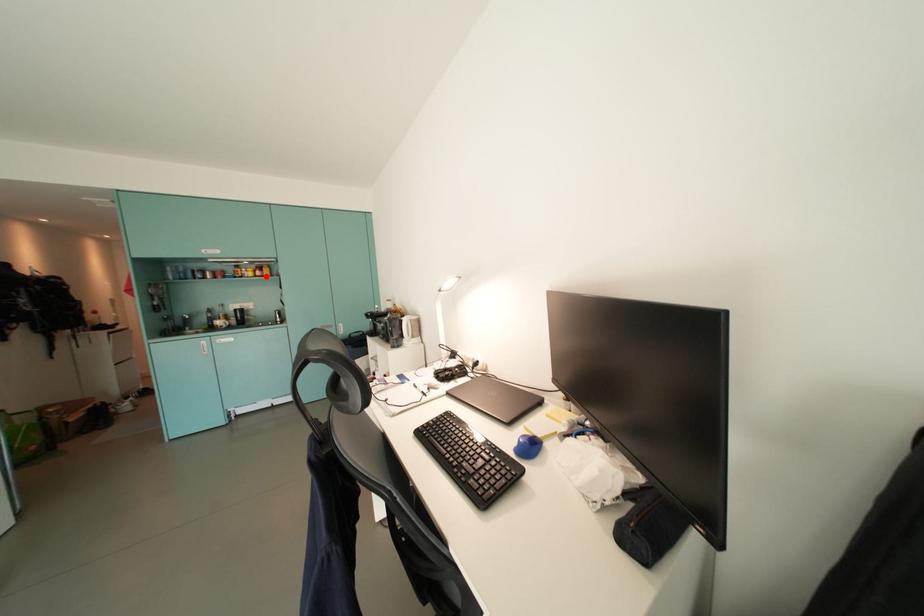
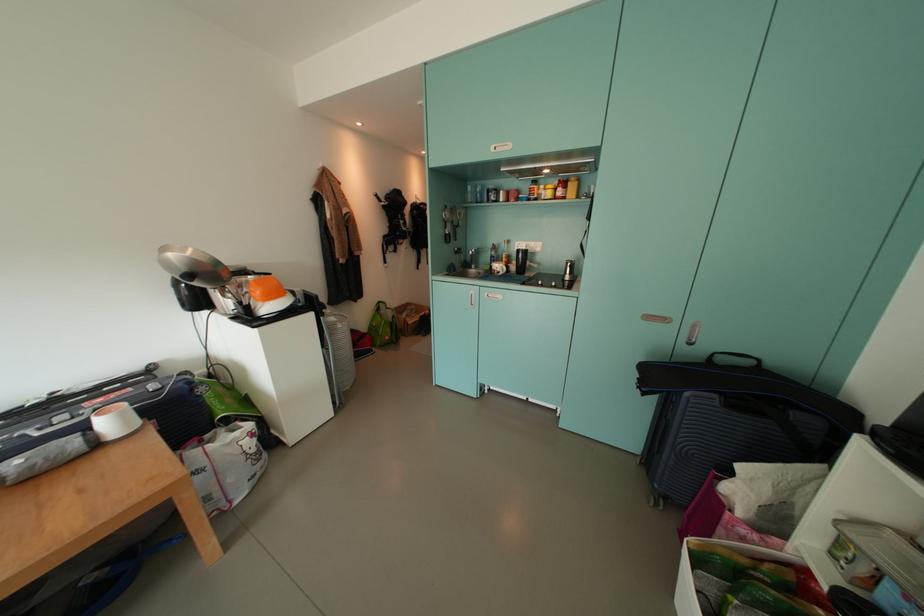
Locate, in the second image, the point that corresponds to the highlighted location in the first image.

(566, 195)